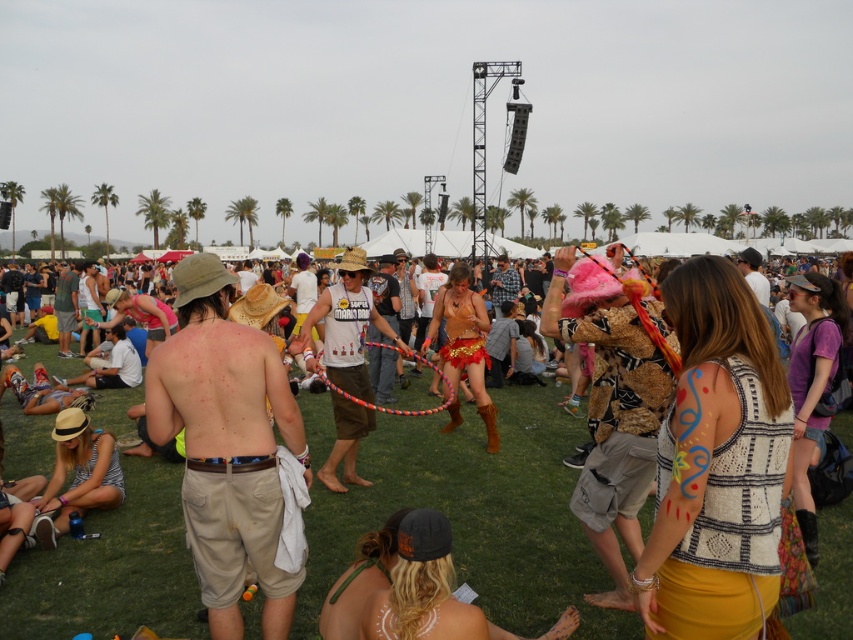
Which is above, white printed tank top at center or matte white t-shirt at center?

white printed tank top at center is higher up.

Who is more forward, (347,378) or (392,257)?

Point (347,378) is in front.

Locate an element on the screen. This screenshot has height=640, width=853. white printed tank top at center is located at coordinates (347, 324).

Locate an element on the screen. white printed tank top at center is located at coordinates (347, 324).

Is white printed tank top at center positioned at the back of matte green shirt at center?

No, white printed tank top at center is closer to the viewer.

Does point (325, 364) come farther from viewer compared to point (74, 308)?

No.

Locate an element on the screen. The width and height of the screenshot is (853, 640). white printed tank top at center is located at coordinates (347, 324).

Which is more to the left, tan cotton shorts at center or checkered fabric shirt at center?

From the viewer's perspective, tan cotton shorts at center appears more on the left side.

Which of these two, tan cotton shorts at center or checkered fabric shirt at center, stands shorter?

checkered fabric shirt at center is shorter.

Describe the element at coordinates (225, 445) in the screenshot. This screenshot has width=853, height=640. I see `tan cotton shorts at center` at that location.

Find the location of a particular element. This screenshot has width=853, height=640. tan cotton shorts at center is located at coordinates tap(225, 445).